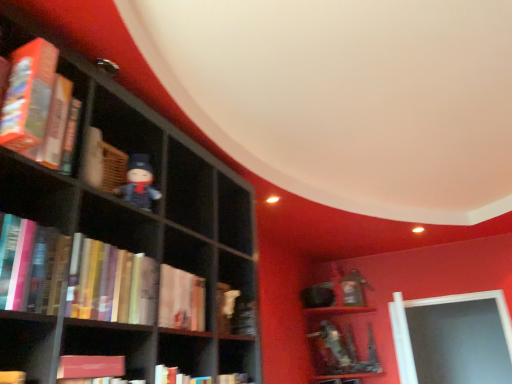
Question: From the image's perspective, is hardcover book at left, which ranks as the 2th book in top-to-bottom order, on top of matte black figurine at center-left?

Choices:
 (A) yes
 (B) no

Answer: (B)

Question: From the image's perspective, does hardcover book at left, which ranks as the 2th book in top-to-bottom order, appear lower than matte black figurine at center-left?

Choices:
 (A) yes
 (B) no

Answer: (A)

Question: Is hardcover book at left, which is the third book from bottom to top, not inside matte black figurine at center-left?

Choices:
 (A) yes
 (B) no

Answer: (A)

Question: Is hardcover book at left, which is the third book from bottom to top, wider than matte black figurine at center-left?

Choices:
 (A) no
 (B) yes

Answer: (B)

Question: Considering the relative sizes of hardcover book at left, which is the third book from bottom to top, and matte black figurine at center-left in the image provided, is hardcover book at left, which is the third book from bottom to top, bigger than matte black figurine at center-left?

Choices:
 (A) yes
 (B) no

Answer: (A)

Question: Is hardcover book at left, marked as the first book in a top-to-bottom arrangement, wider or thinner than hardcover books at left, the second book ordered from the bottom?

Choices:
 (A) thin
 (B) wide

Answer: (B)

Question: Does point (57, 97) appear closer or farther from the camera than point (72, 289)?

Choices:
 (A) closer
 (B) farther

Answer: (B)

Question: From the image's perspective, is hardcover book at left, which is the fourth book in bottom-to-top order, positioned above or below hardcover books at left, the second book ordered from the bottom?

Choices:
 (A) below
 (B) above

Answer: (B)

Question: Would you say hardcover book at left, which is the fourth book in bottom-to-top order, is to the left or to the right of hardcover books at left, the 3th book positioned from the top, in the picture?

Choices:
 (A) left
 (B) right

Answer: (A)

Question: In terms of width, does hardcover book at left, which ranks as the 2th book in top-to-bottom order, look wider or thinner when compared to hardcover book at center, which is the first book from bottom to top?

Choices:
 (A) wide
 (B) thin

Answer: (A)

Question: Is hardcover book at left, which ranks as the 2th book in top-to-bottom order, taller or shorter than hardcover book at center, which is the first book from bottom to top?

Choices:
 (A) tall
 (B) short

Answer: (B)

Question: Based on their sizes in the image, would you say hardcover book at left, which is the third book from bottom to top, is bigger or smaller than hardcover book at center, the fourth book when ordered from top to bottom?

Choices:
 (A) big
 (B) small

Answer: (B)

Question: From a real-world perspective, is hardcover book at left, which ranks as the 2th book in top-to-bottom order, above or below hardcover book at center, the fourth book when ordered from top to bottom?

Choices:
 (A) above
 (B) below

Answer: (B)

Question: Is hardcover book at center, which is the first book from bottom to top, situated inside hardcover book at left, which is the fourth book in bottom-to-top order, or outside?

Choices:
 (A) inside
 (B) outside

Answer: (B)

Question: From the image's perspective, relative to hardcover book at left, marked as the first book in a top-to-bottom arrangement, is hardcover book at center, which is the first book from bottom to top, above or below?

Choices:
 (A) above
 (B) below

Answer: (B)